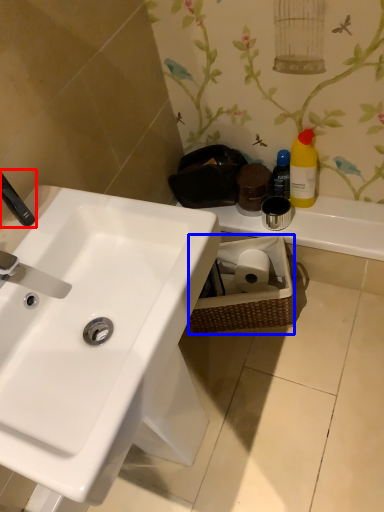
Question: Which point is further to the camera, plumbing fixture (highlighted by a red box) or basket (highlighted by a blue box)?

Choices:
 (A) plumbing fixture
 (B) basket

Answer: (B)